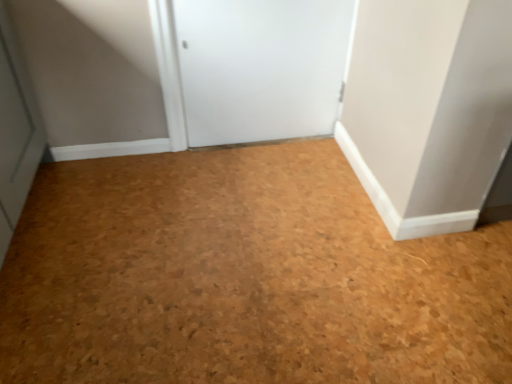
Where is `free region under white matte door at center (from a real-world perspective)`? This screenshot has width=512, height=384. free region under white matte door at center (from a real-world perspective) is located at coordinates (261, 142).